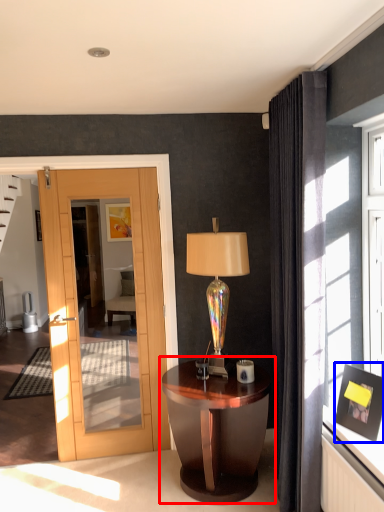
Question: Which object is further to the camera taking this photo, nightstand (highlighted by a red box) or picture frame (highlighted by a blue box)?

Choices:
 (A) nightstand
 (B) picture frame

Answer: (A)